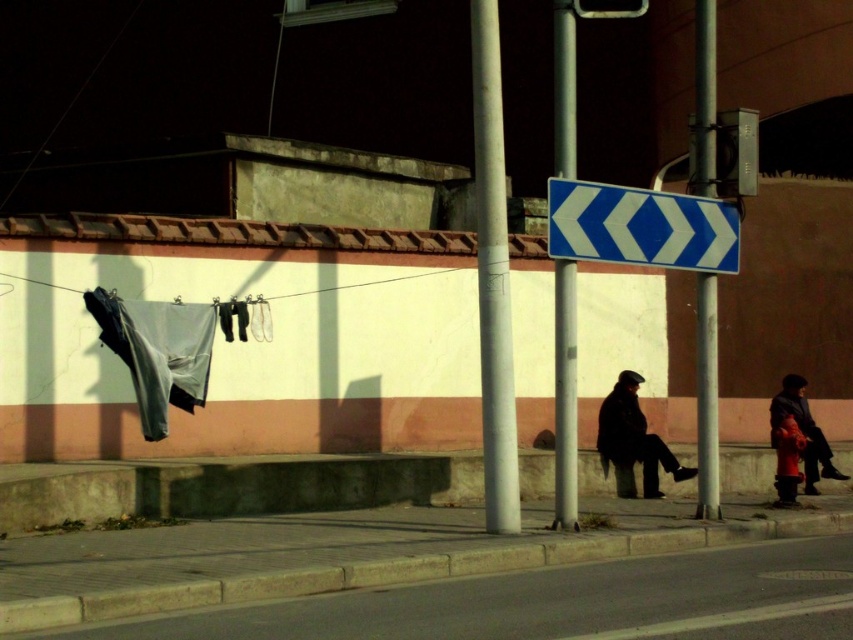
Question: Is blue glossy arrow sign at upper right closer to camera compared to metallic pole at right?

Choices:
 (A) yes
 (B) no

Answer: (A)

Question: Does blue glossy arrow sign at upper right appear over metallic pole at right?

Choices:
 (A) no
 (B) yes

Answer: (A)

Question: Which point is closer to the camera taking this photo?

Choices:
 (A) (706, 355)
 (B) (575, 422)

Answer: (B)

Question: Does gray fabric at left appear over metallic pole at right?

Choices:
 (A) no
 (B) yes

Answer: (A)

Question: Which object appears closest to the camera in this image?

Choices:
 (A) blue glossy arrow sign at upper right
 (B) red matte jacket at lower right
 (C) smooth metal pole at center

Answer: (C)

Question: Which object appears farthest from the camera in this image?

Choices:
 (A) white smooth pole at center
 (B) red woolen coat at lower right
 (C) smooth metal pole at center
 (D) red matte jacket at lower right

Answer: (B)